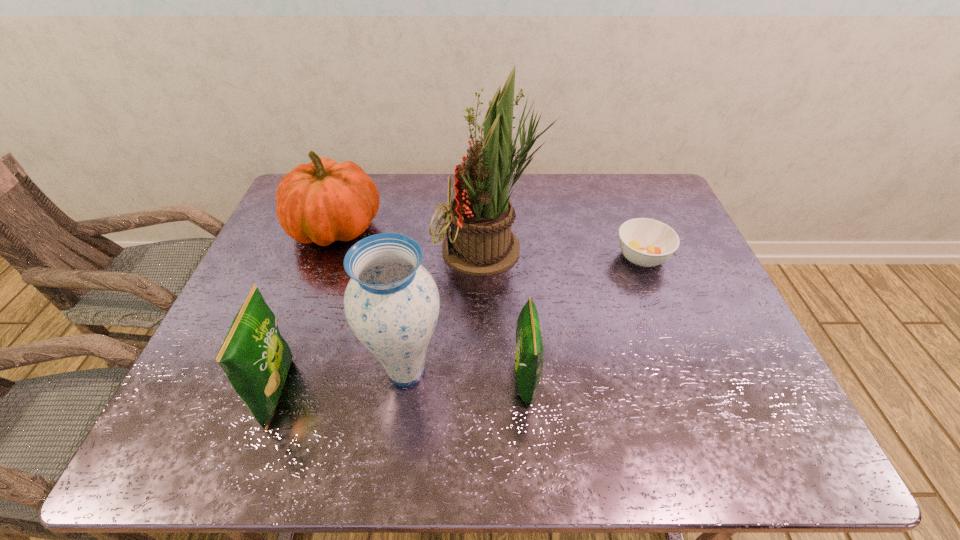
Locate an element on the screen. the taller crisp (potato chip) is located at coordinates (255, 358).

Where is `the shorter crisp (potato chip)`? the shorter crisp (potato chip) is located at coordinates (529, 347).

Locate an element on the screen. The height and width of the screenshot is (540, 960). the second shortest object is located at coordinates (529, 347).

You are a GUI agent. You are given a task and a screenshot of the screen. Output one action in this format:
    pyautogui.click(x=<x>, y=<y>)
    Task: Click on the pumpkin
    The width and height of the screenshot is (960, 540).
    Given the screenshot: What is the action you would take?
    pyautogui.click(x=323, y=201)

Locate an element on the screen. soup bowl is located at coordinates (645, 242).

Identify the location of the rightmost object. (645, 242).

You are a GUI agent. You are given a task and a screenshot of the screen. Output one action in this format:
    pyautogui.click(x=<x>, y=<y>)
    Task: Click on the tallest object
    
    Given the screenshot: What is the action you would take?
    pyautogui.click(x=480, y=242)

I want to click on vase, so click(391, 303).

I want to click on vacant area situated on the front-facing side of the taller crisp (potato chip), so click(389, 392).

Where is `free location located 0.120m on the front-facing side of the right crisp (potato chip)`? This screenshot has height=540, width=960. free location located 0.120m on the front-facing side of the right crisp (potato chip) is located at coordinates (590, 380).